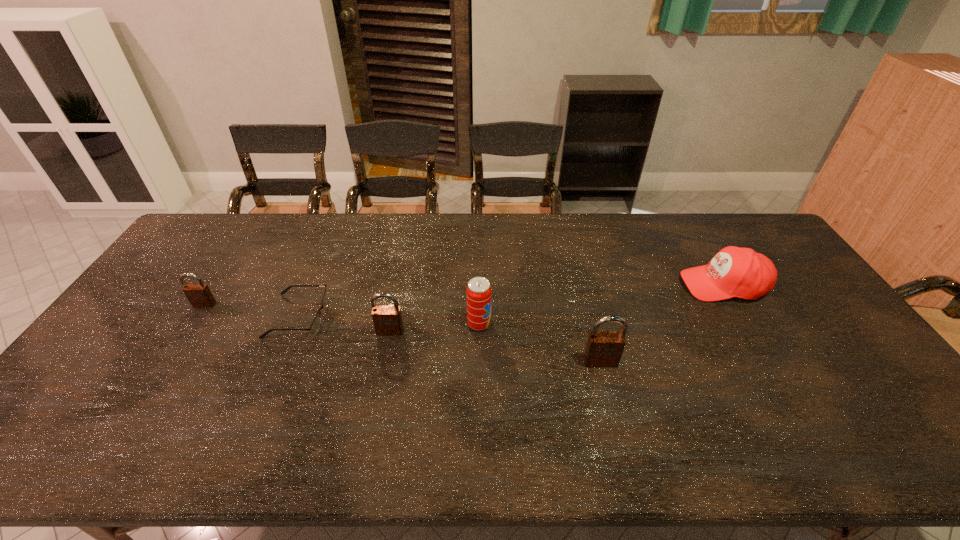
The image size is (960, 540). In order to click on vacant point located between the rightmost padlock and the second tallest padlock in this screenshot , I will do `click(495, 347)`.

At what (x,y) coordinates should I click in order to perform the action: click on empty location between the baseball cap and the fifth object from right to left. Please return your answer as a coordinate pair (x, y). Looking at the image, I should click on (511, 300).

Locate an element on the screen. the closest object to the rightmost object is located at coordinates (604, 348).

Find the location of a particular element. object that ranks as the closest to the shortest object is located at coordinates (387, 320).

I want to click on padlock that is the second closest to the nearest padlock, so click(x=199, y=295).

Find the location of `padlock that is the third nearest to the fourth object from left to right`. padlock that is the third nearest to the fourth object from left to right is located at coordinates (199, 295).

Identify the location of free space that satisfies the following two spatial constraints: 1. on the front panel of the rightmost object; 2. on the front-facing side of the second farthest padlock. This screenshot has width=960, height=540. (751, 331).

I want to click on vacant space that satisfies the following two spatial constraints: 1. on the front-facing side of the second object from left to right; 2. on the back side of the soda can, so click(295, 324).

Identify the location of vacant space that satisfies the following two spatial constraints: 1. on the front-facing side of the spectacles; 2. on the right side of the fourth object from left to right. This screenshot has height=540, width=960. (295, 324).